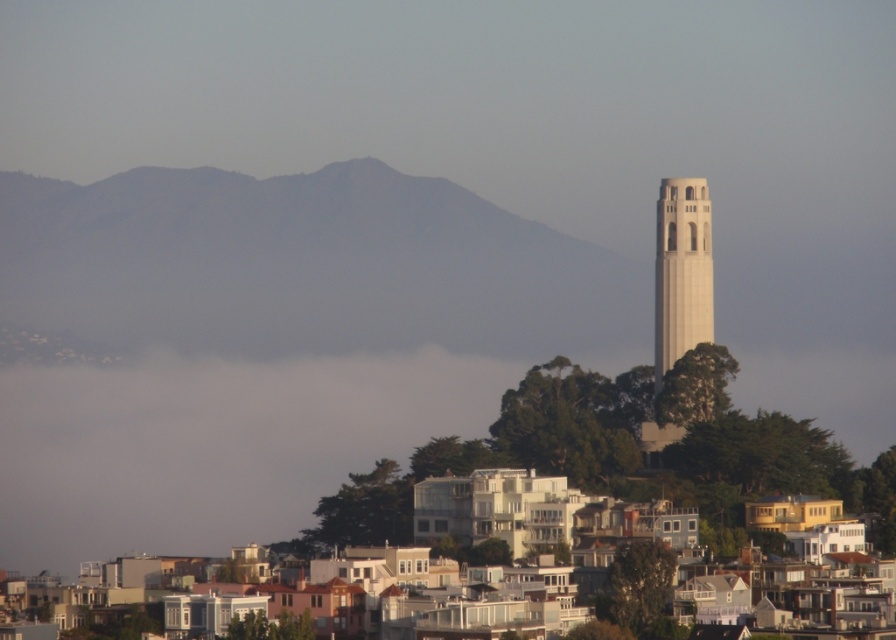
Question: Can you confirm if gray rocky mountain at upper center is wider than white concrete tower at center-right?

Choices:
 (A) no
 (B) yes

Answer: (B)

Question: Which point is farther to the camera?

Choices:
 (A) gray rocky mountain at upper center
 (B) white concrete tower at center-right

Answer: (B)

Question: Which point is farther to the camera?

Choices:
 (A) pyautogui.click(x=679, y=330)
 (B) pyautogui.click(x=55, y=182)

Answer: (B)

Question: Is gray rocky mountain at upper center above white concrete tower at center-right?

Choices:
 (A) no
 (B) yes

Answer: (B)

Question: Does gray rocky mountain at upper center have a greater width compared to white concrete tower at center-right?

Choices:
 (A) yes
 (B) no

Answer: (A)

Question: Which object appears farthest from the camera in this image?

Choices:
 (A) white concrete tower at center-right
 (B) gray rocky mountain at upper center

Answer: (A)